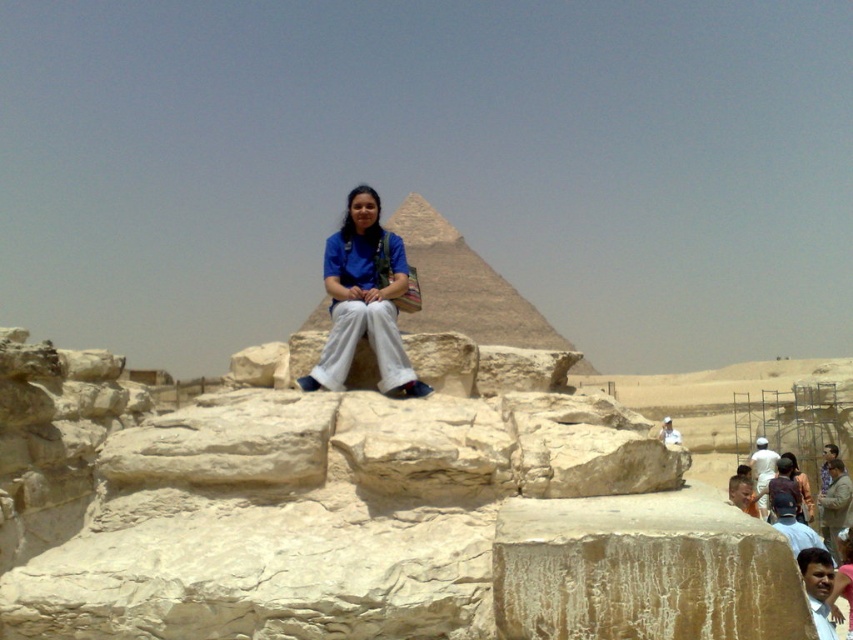
Does smooth beige pyramid at center have a lesser width compared to brown leather jacket at lower right?

Incorrect, smooth beige pyramid at center's width is not less than brown leather jacket at lower right's.

Between smooth beige pyramid at center and brown leather jacket at lower right, which one has less height?

brown leather jacket at lower right is shorter.

At what (x,y) coordinates should I click in order to perform the action: click on smooth beige pyramid at center. Please return your answer as a coordinate pair (x, y). The image size is (853, 640). Looking at the image, I should click on (463, 285).

Can you confirm if blue fabric shirt at center is thinner than white cotton shirt at center?

Yes, blue fabric shirt at center is thinner than white cotton shirt at center.

Does point (381, 332) come in front of point (757, 480)?

Yes, it is.

Where is `blue fabric shirt at center`? The height and width of the screenshot is (640, 853). blue fabric shirt at center is located at coordinates (364, 300).

Can you confirm if blue denim jeans at center is shorter than light brown sandstone man at center?

No.

What do you see at coordinates (792, 524) in the screenshot? I see `blue denim jeans at center` at bounding box center [792, 524].

Is point (817, 541) farther from viewer compared to point (664, 426)?

That is False.

Find the location of a particular element. blue denim jeans at center is located at coordinates (792, 524).